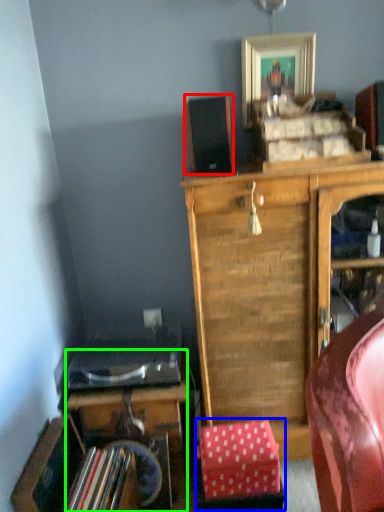
Question: Which object is positioned closest to speaker (highlighted by a red box)? Select from stool (highlighted by a blue box) and desk (highlighted by a green box).

Choices:
 (A) stool
 (B) desk

Answer: (B)